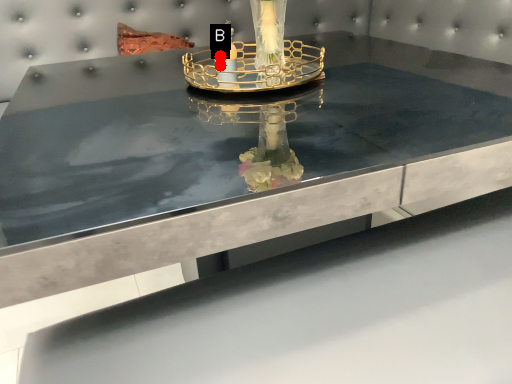
Question: Two points are circled on the image, labeled by A and B beside each circle. Which point appears closest to the camera in this image?

Choices:
 (A) A is closer
 (B) B is closer

Answer: (B)